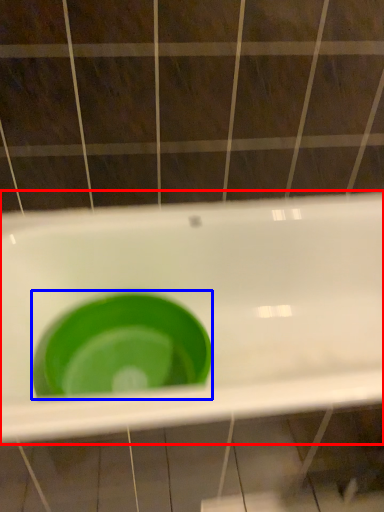
Question: Which point is closer to the camera, sink (highlighted by a red box) or basin (highlighted by a blue box)?

Choices:
 (A) sink
 (B) basin

Answer: (A)